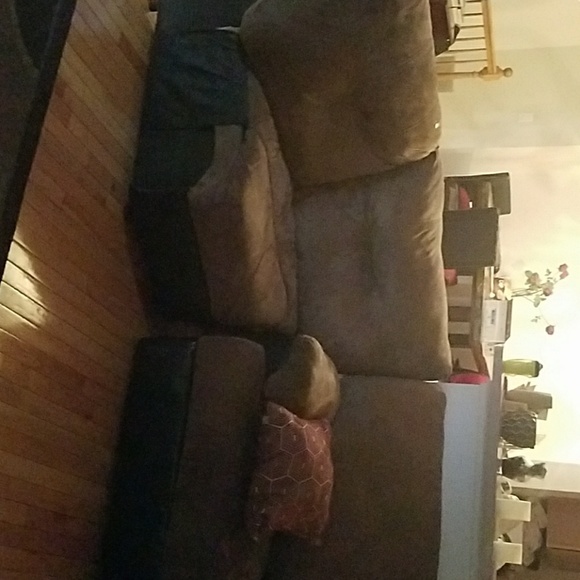
Identify the location of pillow. This screenshot has width=580, height=580. (299, 470), (303, 373).